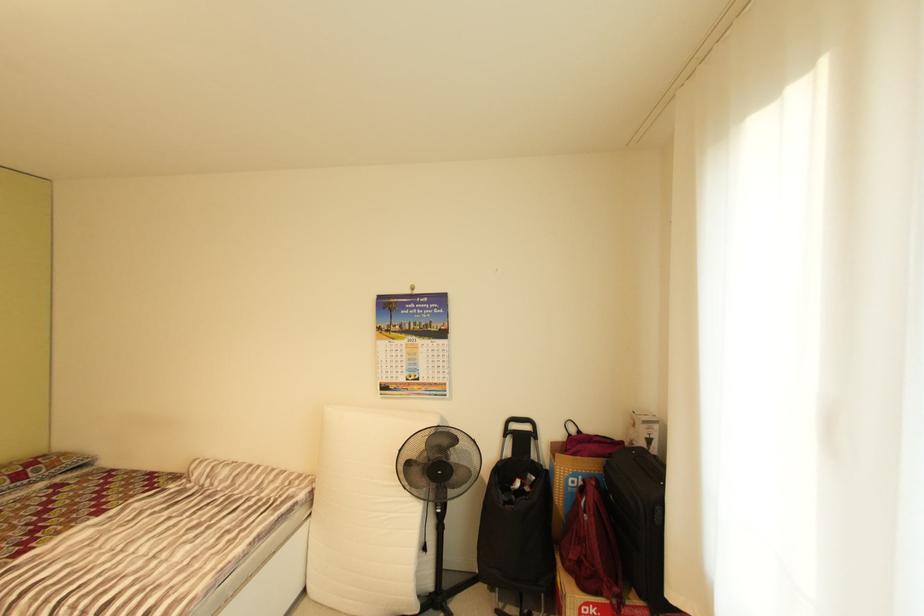
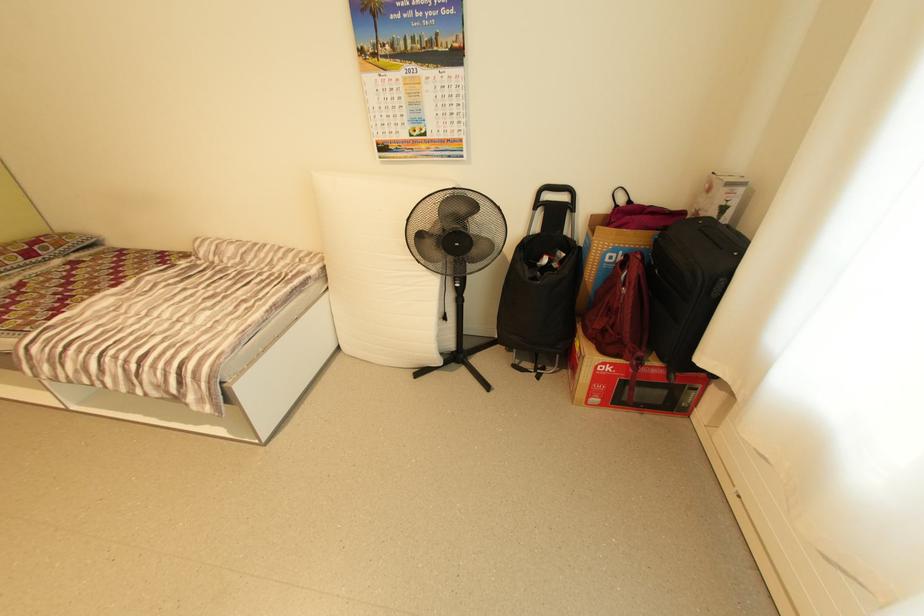
Locate, in the second image, the point that corresponds to (x=579, y=432) in the first image.

(628, 201)